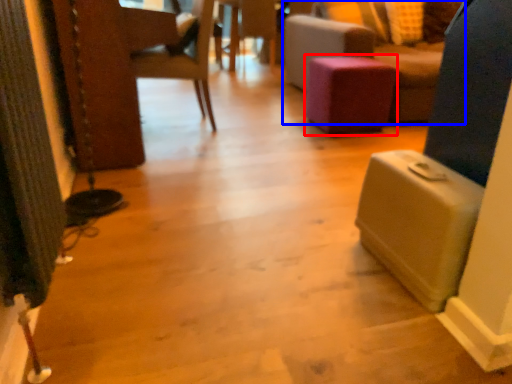
Question: Among these objects, which one is nearest to the camera, stool (highlighted by a red box) or furniture (highlighted by a blue box)?

Choices:
 (A) stool
 (B) furniture

Answer: (B)